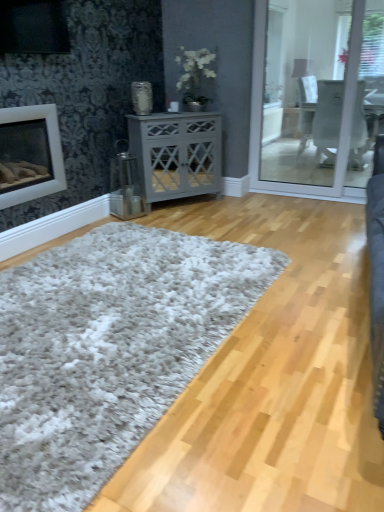
This screenshot has height=512, width=384. What do you see at coordinates (30, 154) in the screenshot? I see `white matte fireplace at left` at bounding box center [30, 154].

Locate an element on the screen. The image size is (384, 512). gray matte cabinet at center is located at coordinates (176, 154).

Is white shaggy rug at center oriented towards gray matte cabinet at center?

No, white shaggy rug at center is not aimed at gray matte cabinet at center.

Considering the sizes of objects white shaggy rug at center and gray matte cabinet at center in the image provided, who is thinner, white shaggy rug at center or gray matte cabinet at center?

With smaller width is gray matte cabinet at center.

Are white shaggy rug at center and gray matte cabinet at center far apart?

Indeed, white shaggy rug at center is not near gray matte cabinet at center.

Considering the points (60, 282) and (49, 119), which point is behind, point (60, 282) or point (49, 119)?

The point (49, 119) is behind.

Considering the sizes of objects white shaggy rug at center and white matte fireplace at left in the image provided, who is wider, white shaggy rug at center or white matte fireplace at left?

white shaggy rug at center is wider.

Consider the image. Between white shaggy rug at center and white matte fireplace at left, which one is positioned in front?

Positioned in front is white shaggy rug at center.

Is gray matte cabinet at center to the left or to the right of white shaggy rug at center in the image?

In the image, gray matte cabinet at center appears on the right side of white shaggy rug at center.

Where is `nightstand that appears above the white shaggy rug at center (from a real-world perspective)`? The width and height of the screenshot is (384, 512). nightstand that appears above the white shaggy rug at center (from a real-world perspective) is located at coordinates (176, 154).

How distant is gray matte cabinet at center from white shaggy rug at center?

A distance of 1.59 meters exists between gray matte cabinet at center and white shaggy rug at center.

From a real-world perspective, is gray matte cabinet at center located beneath white shaggy rug at center?

Actually, gray matte cabinet at center is physically above white shaggy rug at center in the real world.

In the image, is white matte fireplace at left positioned in front of or behind gray matte cabinet at center?

In the image, white matte fireplace at left appears in front of gray matte cabinet at center.

Is gray matte cabinet at center at the back of white matte fireplace at left?

No, white matte fireplace at left's orientation is not away from gray matte cabinet at center.

Does white matte fireplace at left have a greater height compared to gray matte cabinet at center?

No.

In the scene shown: From a real-world perspective, is white matte fireplace at left positioned above or below gray matte cabinet at center?

From a real-world perspective, white matte fireplace at left is physically above gray matte cabinet at center.

In terms of height, does white matte fireplace at left look taller or shorter compared to white shaggy rug at center?

white matte fireplace at left is taller than white shaggy rug at center.

Is white matte fireplace at left facing away from white shaggy rug at center?

That's not correct — white matte fireplace at left is not looking away from white shaggy rug at center.

From a real-world perspective, is white matte fireplace at left located higher than white shaggy rug at center?

Indeed, from a real-world perspective, white matte fireplace at left stands above white shaggy rug at center.

Are white matte fireplace at left and white shaggy rug at center located far from each other?

That's right, there is a large distance between white matte fireplace at left and white shaggy rug at center.

From the image's perspective, which one is positioned higher, gray matte cabinet at center or white matte fireplace at left?

gray matte cabinet at center is shown above in the image.

Does gray matte cabinet at center have a lesser width compared to white matte fireplace at left?

In fact, gray matte cabinet at center might be wider than white matte fireplace at left.

From a real-world perspective, is gray matte cabinet at center positioned over white matte fireplace at left based on gravity?

No, from a real-world perspective, gray matte cabinet at center is not over white matte fireplace at left

Who is smaller, gray matte cabinet at center or white matte fireplace at left?

With smaller size is white matte fireplace at left.

Image resolution: width=384 pixels, height=512 pixels. In order to click on plain below the gray matte cabinet at center (from a real-world perspective) in this screenshot , I will do `click(108, 349)`.

The image size is (384, 512). What are the coordinates of `fireplace behind the white shaggy rug at center` in the screenshot? It's located at (30, 154).

Estimate the real-world distances between objects in this image. Which object is closer to gray matte cabinet at center, white matte fireplace at left or white shaggy rug at center?

Based on the image, white matte fireplace at left appears to be nearer to gray matte cabinet at center.

Looking at the image, which one is located closer to white matte fireplace at left, white shaggy rug at center or gray matte cabinet at center?

gray matte cabinet at center is positioned closer to the anchor white matte fireplace at left.

Based on their spatial positions, is gray matte cabinet at center or white shaggy rug at center closer to white matte fireplace at left?

gray matte cabinet at center.

Considering their positions, is white matte fireplace at left positioned further to white shaggy rug at center than gray matte cabinet at center?

gray matte cabinet at center is positioned further to the anchor white shaggy rug at center.

Looking at the image, which one is located closer to white shaggy rug at center, gray matte cabinet at center or white matte fireplace at left?

Among the two, white matte fireplace at left is located nearer to white shaggy rug at center.

Based on their spatial positions, is white shaggy rug at center or white matte fireplace at left closer to gray matte cabinet at center?

white matte fireplace at left is positioned closer to the anchor gray matte cabinet at center.

At what (x,y) coordinates should I click in order to perform the action: click on fireplace located between white shaggy rug at center and gray matte cabinet at center in the depth direction. Please return your answer as a coordinate pair (x, y). Looking at the image, I should click on (30, 154).